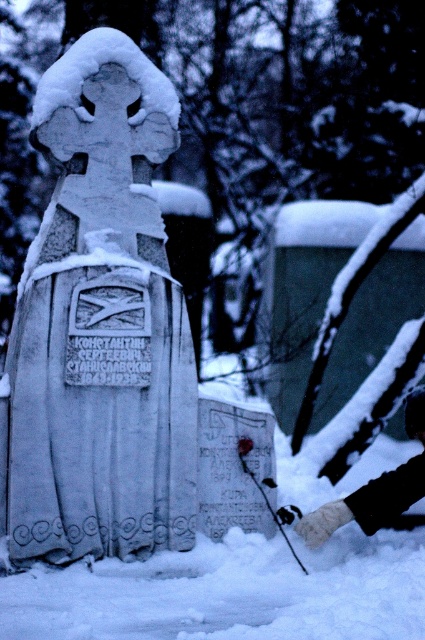
Is white stone cross at center bigger than fuzzy woolen glove at lower right?

Indeed, white stone cross at center has a larger size compared to fuzzy woolen glove at lower right.

Does white stone cross at center appear on the left side of fuzzy woolen glove at lower right?

Indeed, white stone cross at center is positioned on the left side of fuzzy woolen glove at lower right.

Who is more distant from viewer, (x=70, y=291) or (x=373, y=509)?

Positioned behind is point (x=373, y=509).

The height and width of the screenshot is (640, 425). Find the location of `white stone cross at center`. white stone cross at center is located at coordinates (101, 324).